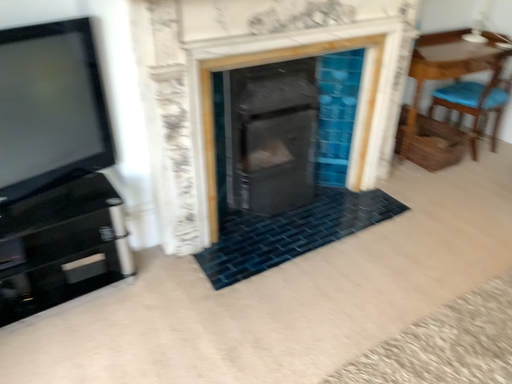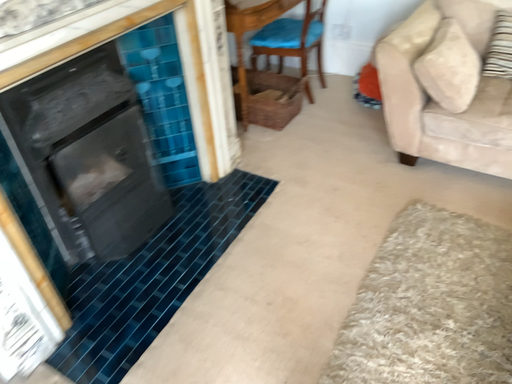
Question: How did the camera likely rotate when shooting the video?

Choices:
 (A) rotated right
 (B) rotated left

Answer: (A)